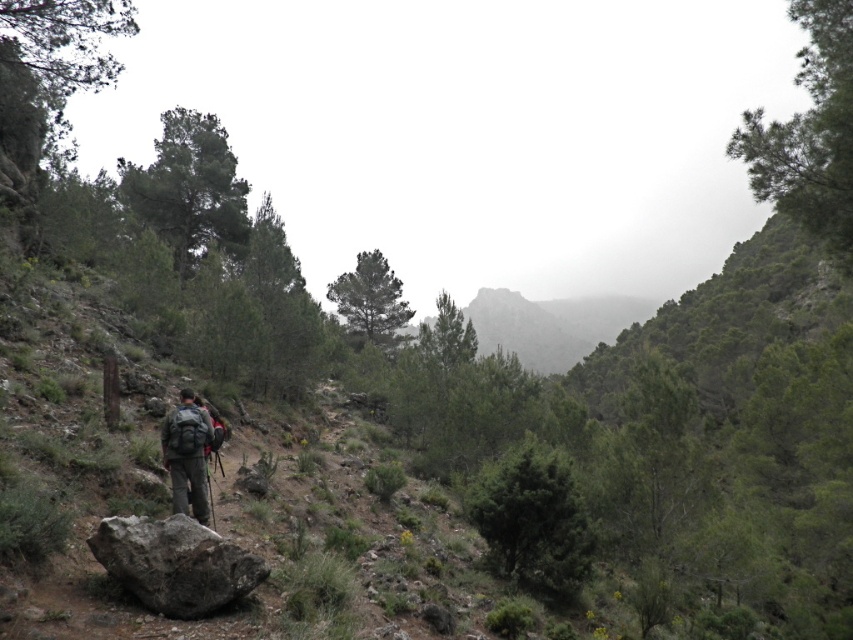
You are a hiker planning to traverse the trail. You notice the gray rough rock at lower left and the rocky gray mountain at center. How far apart are these two landmarks?

The gray rough rock at lower left and the rocky gray mountain at center are 103.69 meters apart from each other.

You are navigating a narrow rocky trail and need to step carefully. There is a gray rough rock at lower left. Based on its position, can you determine if this rock is near the edge of the trail?

The gray rough rock at lower left is located at point (175, 563), which indicates it is positioned near the edge of the trail. Therefore, it is advisable to avoid stepping on it to maintain stability while walking.

You are a hiker trying to decide whether to take a photo of the rocky gray mountain at center and the matte gray backpack at center. Which object should you focus on first if you want to capture both in a single frame without moving the camera?

The rocky gray mountain at center is taller than the matte gray backpack at center, so you should focus on the rocky gray mountain at center first to ensure it fits entirely within the frame.